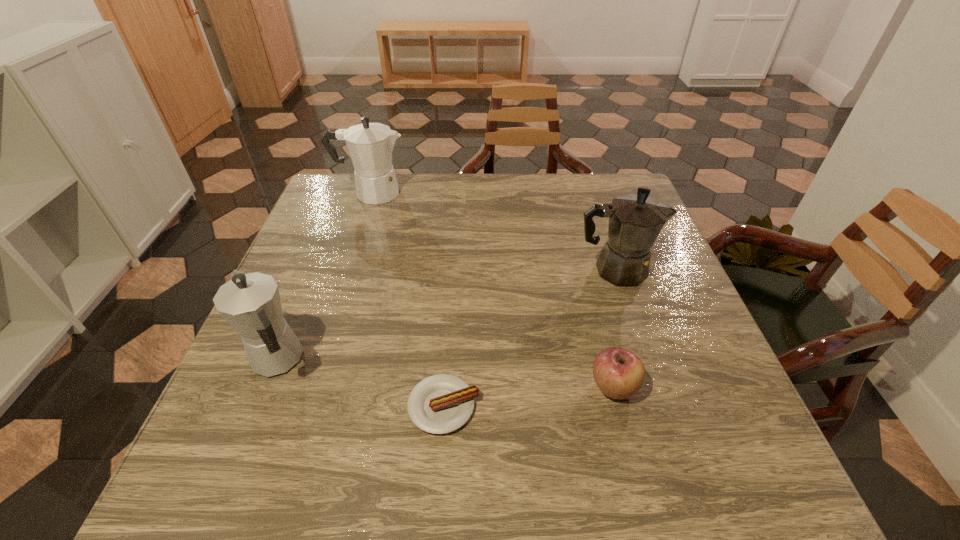
Identify the location of free space located 0.350m on the back of the third object from right to left. The height and width of the screenshot is (540, 960). (453, 259).

Find the location of a particular element. This screenshot has height=540, width=960. object that is at the far edge is located at coordinates (370, 145).

Locate an element on the screen. Image resolution: width=960 pixels, height=540 pixels. object present at the right edge is located at coordinates (635, 221).

Identify the location of object that is at the far left corner. (370, 145).

Locate an element on the screen. The height and width of the screenshot is (540, 960). vacant space at the far edge of the desktop is located at coordinates (478, 209).

This screenshot has height=540, width=960. In the image, there is a desktop. Find the location of `free region at the near edge`. free region at the near edge is located at coordinates (640, 464).

In the image, there is a desktop. Where is `free space at the left edge`? Image resolution: width=960 pixels, height=540 pixels. free space at the left edge is located at coordinates (339, 244).

At what (x,y) coordinates should I click in order to perform the action: click on free space at the right edge of the desktop. Please return your answer as a coordinate pair (x, y). This screenshot has height=540, width=960. Looking at the image, I should click on (680, 390).

The height and width of the screenshot is (540, 960). Identify the location of vacant area at the far right corner of the desktop. (599, 176).

At what (x,y) coordinates should I click in order to perform the action: click on vacant space in between the apple and the farthest object. Please return your answer as a coordinate pair (x, y). Looking at the image, I should click on (492, 290).